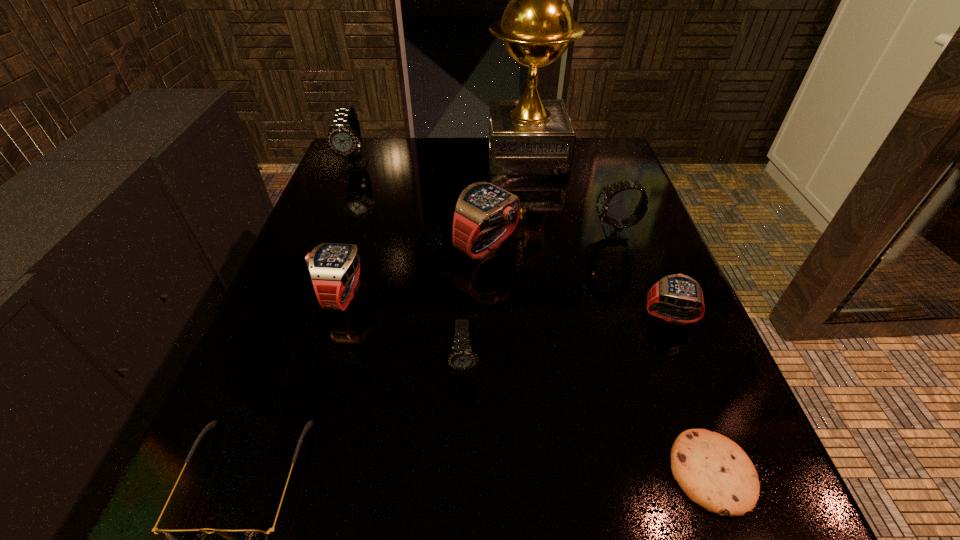
This screenshot has width=960, height=540. Identify the location of cookie that is positioned at the right edge. (714, 472).

Where is `object that is at the far left corner`? object that is at the far left corner is located at coordinates (344, 137).

The height and width of the screenshot is (540, 960). I want to click on object that is at the far right corner, so click(x=529, y=136).

Identify the location of object present at the near right corner. This screenshot has width=960, height=540. (714, 472).

You are a GUI agent. You are given a task and a screenshot of the screen. Output one action in this format:
    pyautogui.click(x=<x>, y=<y>)
    Task: Click on the free location at the far edge
    
    Given the screenshot: What is the action you would take?
    pyautogui.click(x=409, y=181)

Where is `vacant area at the near edge of the desktop`? vacant area at the near edge of the desktop is located at coordinates (575, 495).

At what (x,y) coordinates should I click in order to perform the action: click on vacant region at the left edge of the desktop. Please return your answer as a coordinate pair (x, y). This screenshot has width=960, height=540. Looking at the image, I should click on (320, 222).

At what (x,y) coordinates should I click in order to perform the action: click on vacant area at the right edge. Please return your answer as a coordinate pair (x, y). This screenshot has width=960, height=540. Looking at the image, I should click on (655, 341).

The height and width of the screenshot is (540, 960). I want to click on blank space at the far left corner of the desktop, so click(x=394, y=180).

In the image, there is a desktop. At what (x,y) coordinates should I click in order to perform the action: click on free space at the near left corner. Please return your answer as a coordinate pair (x, y). This screenshot has height=540, width=960. Looking at the image, I should click on (239, 500).